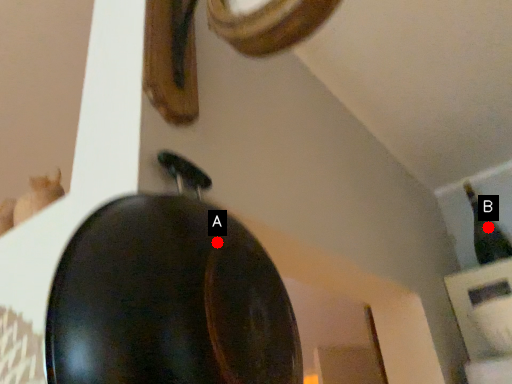
Question: Two points are circled on the image, labeled by A and B beside each circle. Which of the following is the closest to the observer?

Choices:
 (A) A is closer
 (B) B is closer

Answer: (A)